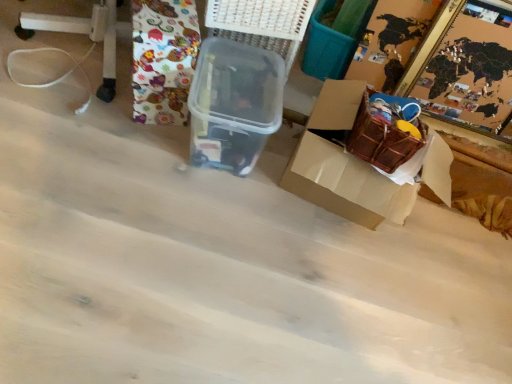
Where is `free location in front of patterned fabric at upper left`? The image size is (512, 384). free location in front of patterned fabric at upper left is located at coordinates (124, 139).